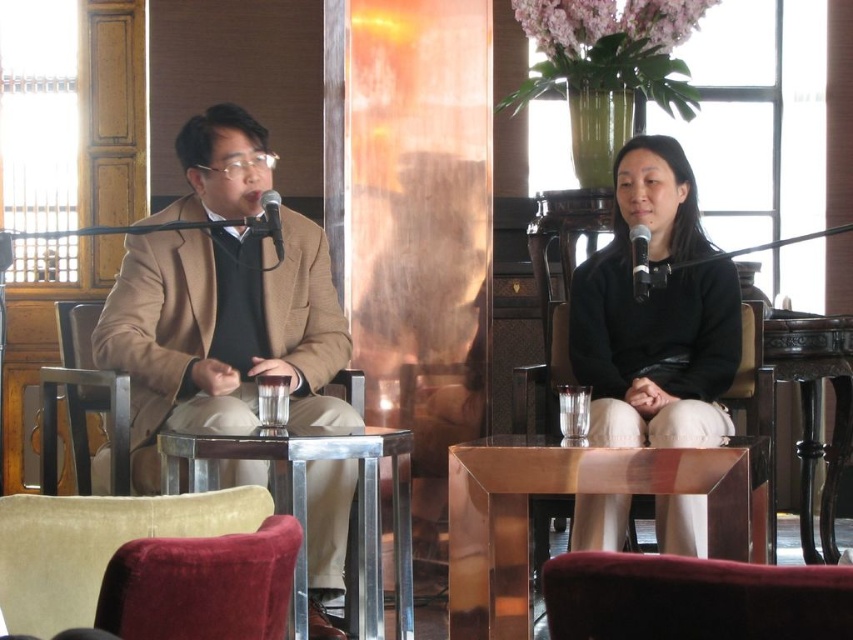
Question: Can you confirm if metallic gold table at center is positioned to the left of metallic silver table at center?

Choices:
 (A) no
 (B) yes

Answer: (A)

Question: Which point appears closest to the camera in this image?

Choices:
 (A) (467, 524)
 (B) (558, 588)
 (C) (613, 387)

Answer: (B)

Question: Which point appears farthest from the camera in this image?

Choices:
 (A) (796, 596)
 (B) (167, 211)
 (C) (840, 454)

Answer: (C)

Question: Can you confirm if matte brown blazer at left is bigger than black polished wood table at right?

Choices:
 (A) yes
 (B) no

Answer: (B)

Question: Is metallic gold table at center above black polished wood table at right?

Choices:
 (A) no
 (B) yes

Answer: (A)

Question: Which object appears closest to the camera in this image?

Choices:
 (A) metallic silver table at center
 (B) metallic gold table at center
 (C) matte brown blazer at left

Answer: (A)